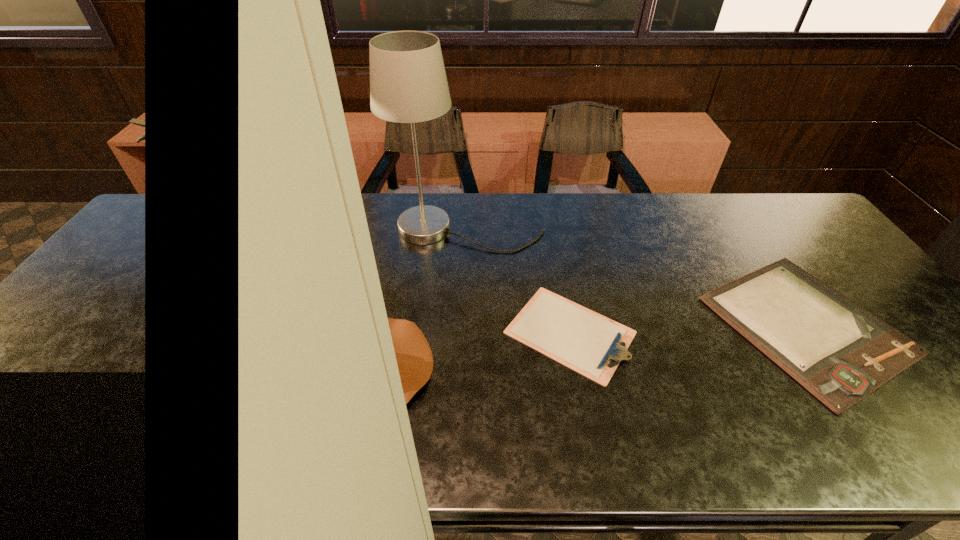
Find the location of `vacant space at the far edge of the desktop`. vacant space at the far edge of the desktop is located at coordinates 389,208.

Locate an element on the screen. vacant space at the far right corner is located at coordinates (781, 223).

Locate an element on the screen. vacant space that's between the cowboy hat and the tallest object is located at coordinates (404, 300).

Find the location of a particular element. The height and width of the screenshot is (540, 960). vacant area between the cowboy hat and the farthest object is located at coordinates (404, 300).

Where is `vacant point located between the second tallest object and the left clipboard`? This screenshot has height=540, width=960. vacant point located between the second tallest object and the left clipboard is located at coordinates (455, 352).

What are the coordinates of `the third closest object to the farthest object` in the screenshot? It's located at (838, 351).

Find the location of a particular element. The width and height of the screenshot is (960, 540). object that is the closest one to the rightmost object is located at coordinates (589, 343).